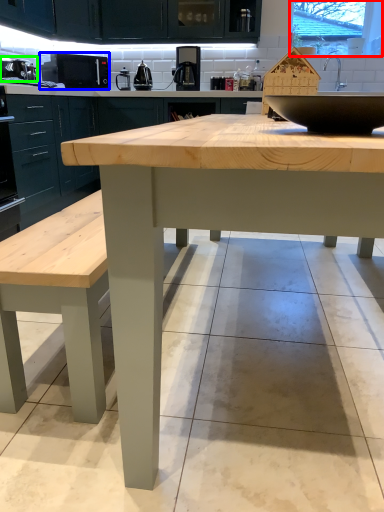
Question: Based on their relative distances, which object is farther from window screen (highlighted by a red box)? Choose from appliance (highlighted by a blue box) and appliance (highlighted by a green box).

Choices:
 (A) appliance
 (B) appliance

Answer: (B)